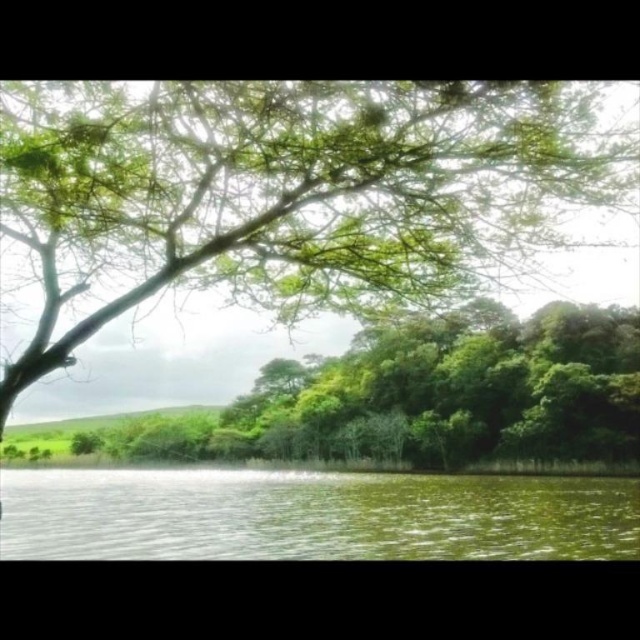
You are standing at the edge of the lake and see the green leafy tree at upper left and the green liquid at lower center. Which object is located to the right of the other?

The green leafy tree at upper left is positioned on the right side of green liquid at lower center.